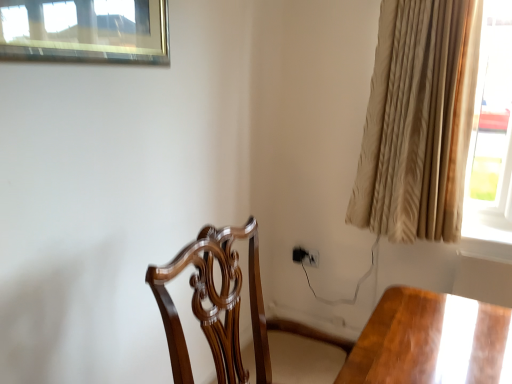
Question: Considering the positions of beige textured curtain at right and polished wood chair at center in the image, is beige textured curtain at right taller or shorter than polished wood chair at center?

Choices:
 (A) short
 (B) tall

Answer: (B)

Question: Is beige textured curtain at right wider or thinner than polished wood chair at center?

Choices:
 (A) wide
 (B) thin

Answer: (B)

Question: From a real-world perspective, is beige textured curtain at right physically located above or below polished wood chair at center?

Choices:
 (A) above
 (B) below

Answer: (A)

Question: Does point (228, 233) appear closer or farther from the camera than point (394, 31)?

Choices:
 (A) farther
 (B) closer

Answer: (B)

Question: Would you say polished wood chair at center is to the left or to the right of beige textured curtain at right in the picture?

Choices:
 (A) left
 (B) right

Answer: (A)

Question: Which is correct: polished wood chair at center is inside beige textured curtain at right, or outside of it?

Choices:
 (A) outside
 (B) inside

Answer: (A)

Question: From the image's perspective, is polished wood chair at center above or below beige textured curtain at right?

Choices:
 (A) above
 (B) below

Answer: (B)